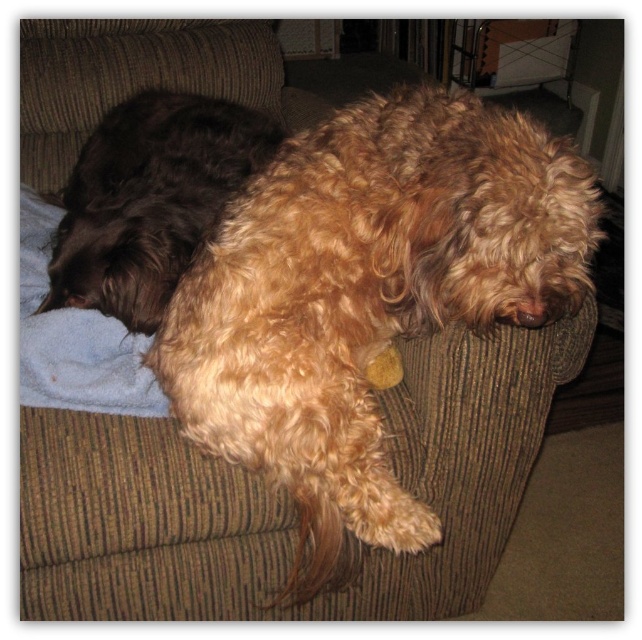
Question: Does fuzzy brown dog at center have a lesser width compared to shaggy brown dog at upper left?

Choices:
 (A) no
 (B) yes

Answer: (A)

Question: Is fuzzy brown dog at center above shaggy brown dog at upper left?

Choices:
 (A) no
 (B) yes

Answer: (A)

Question: Which point appears farthest from the camera in this image?

Choices:
 (A) (80, 234)
 (B) (351, 356)

Answer: (A)

Question: Which point is closer to the camera taking this photo?

Choices:
 (A) (198, 236)
 (B) (413, 205)

Answer: (B)

Question: Can you confirm if fuzzy brown dog at center is wider than shaggy brown dog at upper left?

Choices:
 (A) yes
 (B) no

Answer: (A)